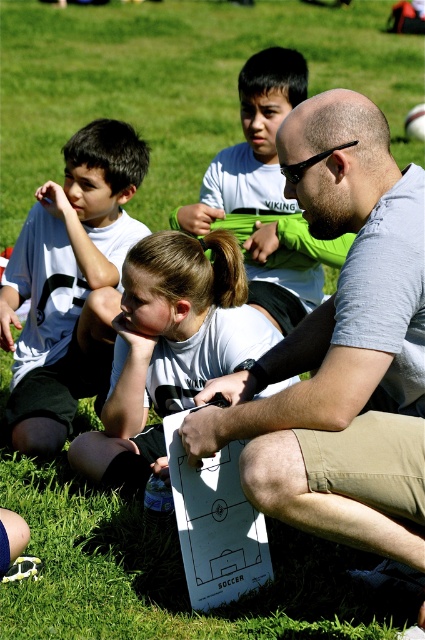
Does white matte shirt at upper left lie behind white matte paper at center?

That is True.

From the picture: Between white matte shirt at upper left and white matte paper at center, which one has less height?

With less height is white matte paper at center.

Where is `white matte shirt at upper left`? The height and width of the screenshot is (640, 425). white matte shirt at upper left is located at coordinates (70, 282).

Locate an element on the screen. The width and height of the screenshot is (425, 640). white matte shirt at upper left is located at coordinates (70, 282).